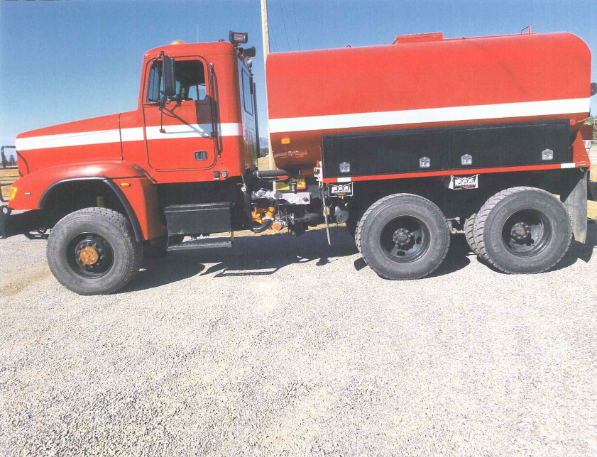
Locate an element on the screen. This screenshot has width=597, height=457. yellow lights is located at coordinates (284, 139), (178, 42), (127, 184), (13, 194).